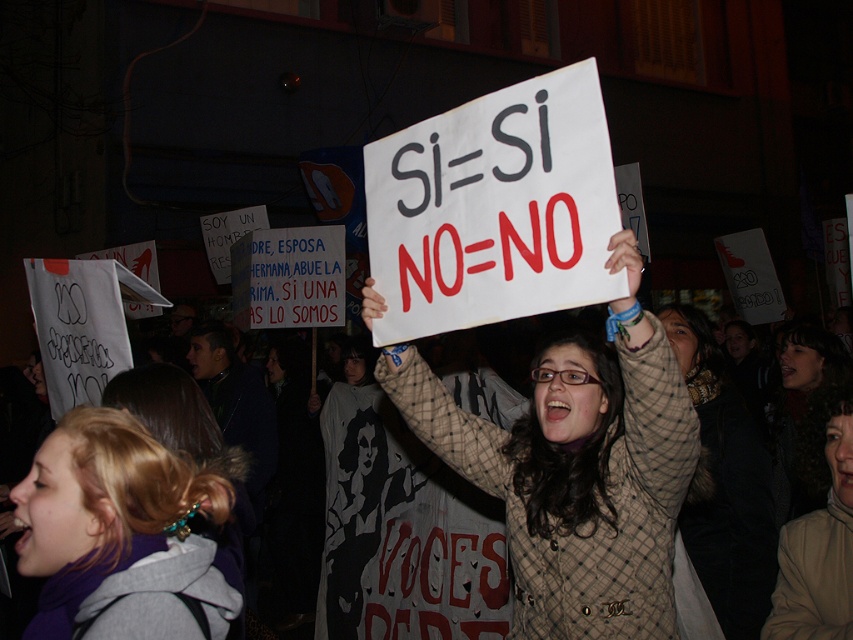
Question: Can you confirm if plaid fabric coat at center is positioned to the right of blonde hair at center?

Choices:
 (A) yes
 (B) no

Answer: (A)

Question: Among these objects, which one is nearest to the camera?

Choices:
 (A) blonde hair at center
 (B) plaid fabric coat at center

Answer: (A)

Question: Observing the image, what is the correct spatial positioning of plaid fabric coat at center in reference to blonde hair at center?

Choices:
 (A) left
 (B) right

Answer: (B)

Question: Which point appears farthest from the camera in this image?

Choices:
 (A) (125, 470)
 (B) (676, 477)

Answer: (B)

Question: Does plaid fabric coat at center have a smaller size compared to blonde hair at center?

Choices:
 (A) yes
 (B) no

Answer: (B)